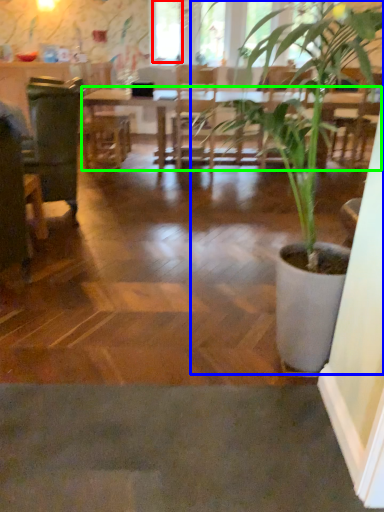
Question: Estimate the real-world distances between objects in this image. Which object is closer to window screen (highlighted by a red box), houseplant (highlighted by a blue box) or table (highlighted by a green box)?

Choices:
 (A) houseplant
 (B) table

Answer: (B)